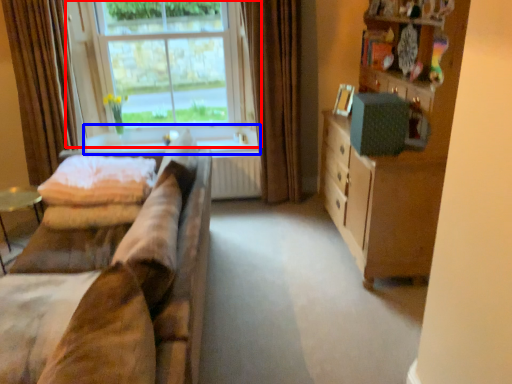
Question: Which object appears closest to the camera in this image, window (highlighted by a red box) or window sill (highlighted by a blue box)?

Choices:
 (A) window
 (B) window sill

Answer: (A)